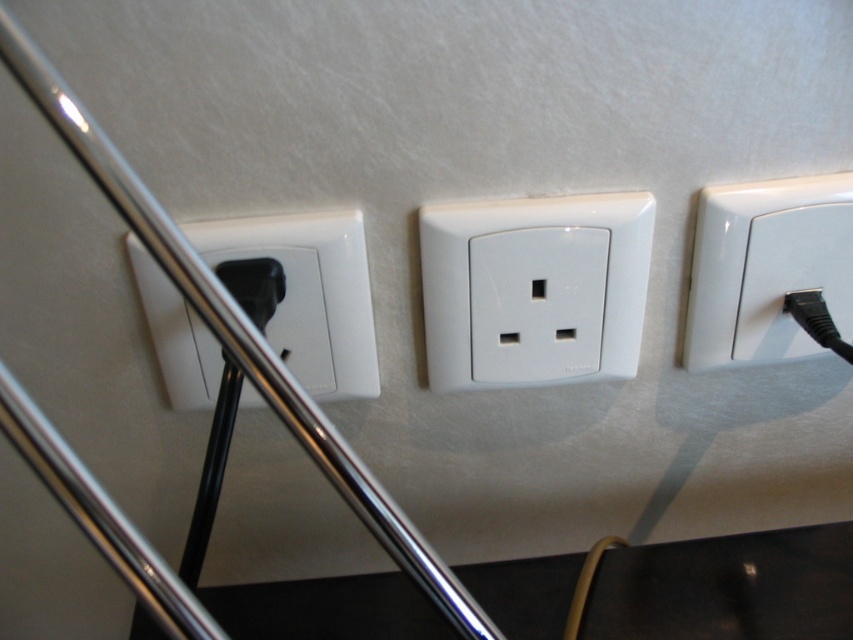
Question: Can you confirm if white glossy electrical outlet at center is smaller than white plastic outlet at left?

Choices:
 (A) no
 (B) yes

Answer: (A)

Question: Which point is farther to the camera?

Choices:
 (A) (741, 241)
 (B) (289, 243)

Answer: (A)

Question: Can you confirm if white glossy electrical outlet at center is positioned to the left of white plastic outlet at left?

Choices:
 (A) no
 (B) yes

Answer: (A)

Question: Is white glossy electrical outlet at center thinner than white glossy electrical outlet at upper right?

Choices:
 (A) yes
 (B) no

Answer: (B)

Question: Which is nearer to the white glossy electrical outlet at upper right?

Choices:
 (A) white glossy electrical outlet at center
 (B) white plastic outlet at left

Answer: (A)

Question: Among these points, which one is farthest from the camera?

Choices:
 (A) (375, 388)
 (B) (614, 234)
 (C) (828, 301)

Answer: (A)